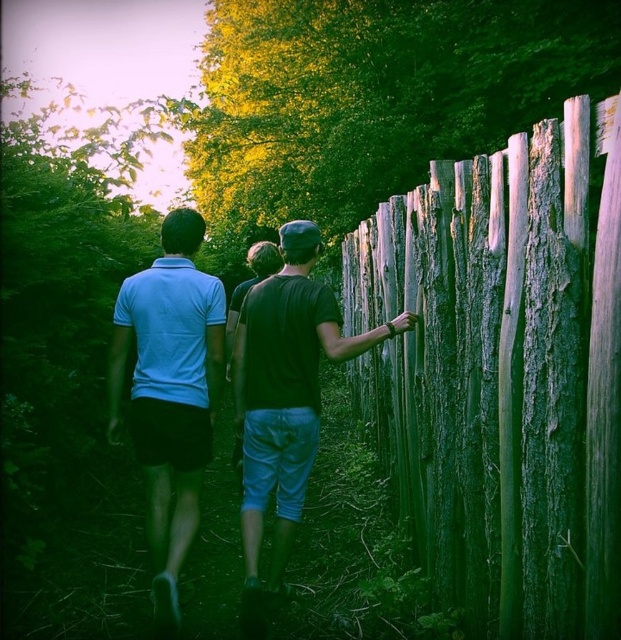
Question: Which point appears closest to the camera in this image?

Choices:
 (A) (473, 186)
 (B) (256, 512)

Answer: (A)

Question: From the image, what is the correct spatial relationship of weathered wood fence at right in relation to matte black shirt at right?

Choices:
 (A) below
 (B) above

Answer: (B)

Question: Does matte blue shirt at center have a greater width compared to matte black shirt at right?

Choices:
 (A) no
 (B) yes

Answer: (A)

Question: Which object appears closest to the camera in this image?

Choices:
 (A) weathered wood fence at right
 (B) matte black shirt at right

Answer: (A)

Question: Can you confirm if matte blue shirt at center is positioned above matte black shirt at right?

Choices:
 (A) yes
 (B) no

Answer: (A)

Question: Which object is farther from the camera taking this photo?

Choices:
 (A) matte blue shirt at center
 (B) weathered wood fence at right

Answer: (A)